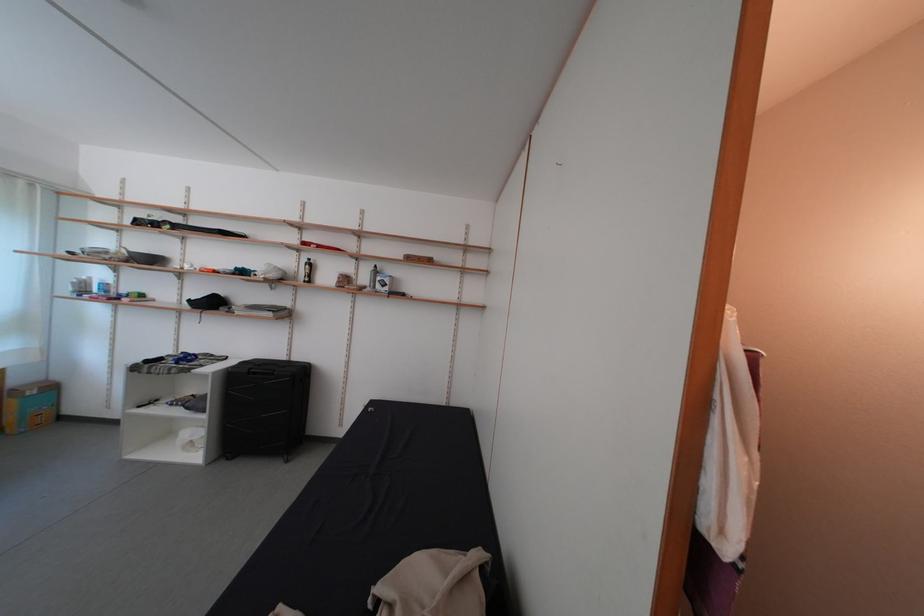
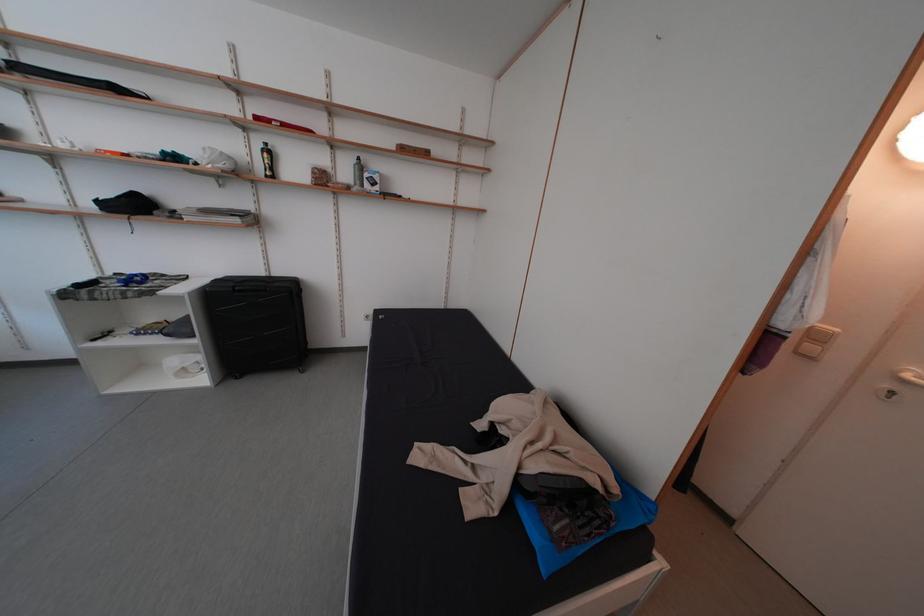
Where in the second image is the point corresponding to [315,267] from the first image?

(272, 152)